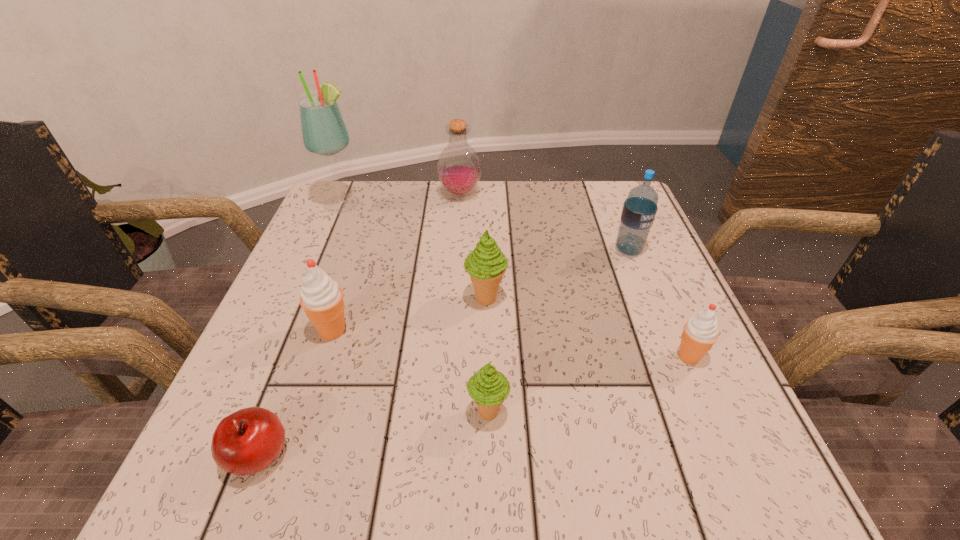
Find the location of `object located at the far left corner`. object located at the far left corner is located at coordinates (324, 132).

This screenshot has height=540, width=960. I want to click on object that is at the near left corner, so click(x=245, y=442).

This screenshot has width=960, height=540. I want to click on vacant area at the far edge of the desktop, so click(566, 205).

This screenshot has height=540, width=960. In the image, there is a desktop. What are the coordinates of `vacant space at the near edge` in the screenshot? It's located at (456, 459).

Where is `vacant region at the left edge of the desktop`? Image resolution: width=960 pixels, height=540 pixels. vacant region at the left edge of the desktop is located at coordinates (271, 377).

Where is `free space at the right edge of the desktop`? This screenshot has height=540, width=960. free space at the right edge of the desktop is located at coordinates (655, 312).

Find the location of `free space at the near left corner of the desktop`. free space at the near left corner of the desktop is located at coordinates (287, 487).

What are the coordinates of `free region at the far right corner of the desktop` in the screenshot? It's located at (619, 214).

Locate an element on the screen. unoccupied area between the nearer green icecream and the right red icecream is located at coordinates coord(588,384).

Locate an element on the screen. Image resolution: width=960 pixels, height=540 pixels. empty location between the tallest object and the fourth farthest object is located at coordinates (415, 251).